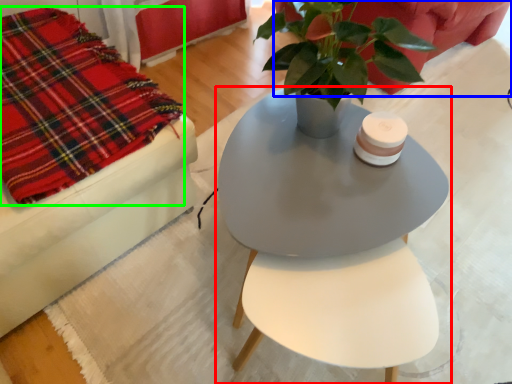
Question: Considering the real-world distances, which object is farthest from table (highlighted by a red box)? couch (highlighted by a blue box) or cloth (highlighted by a green box)?

Choices:
 (A) couch
 (B) cloth

Answer: (B)